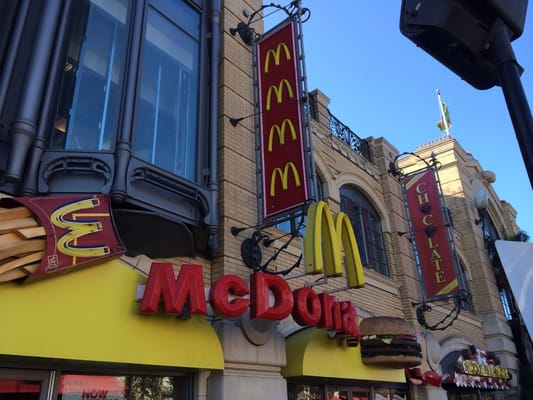
This screenshot has height=400, width=533. What are the coordinates of `window` in the screenshot? It's located at (153, 102), (110, 62).